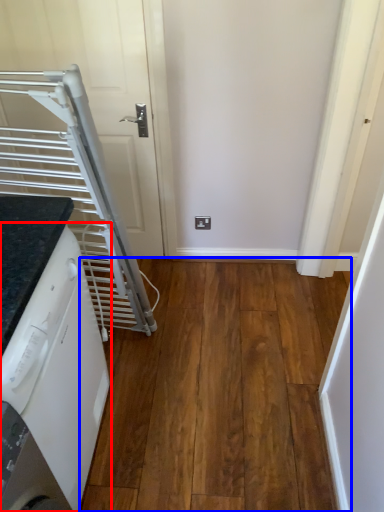
Question: Which object is closer to the camera taking this photo, home appliance (highlighted by a red box) or hardwood (highlighted by a blue box)?

Choices:
 (A) home appliance
 (B) hardwood

Answer: (A)